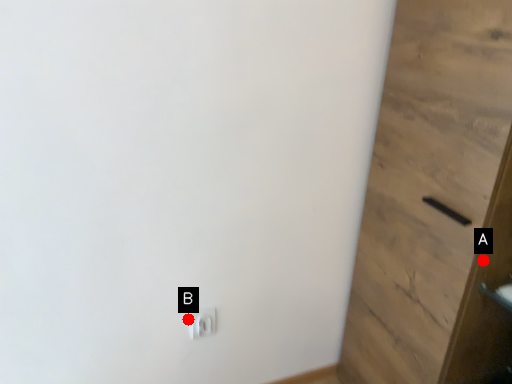
Question: Two points are circled on the image, labeled by A and B beside each circle. Which point is farther to the camera?

Choices:
 (A) A is further
 (B) B is further

Answer: (B)